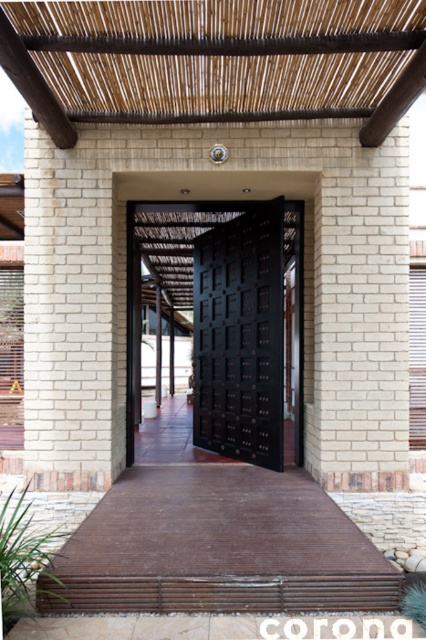
Question: Which of the following is the farthest from the observer?

Choices:
 (A) white brick pillar at left
 (B) white brick pillar at center
 (C) black matte door at center

Answer: (C)

Question: Estimate the real-world distances between objects in this image. Which object is closer to the white brick pillar at center?

Choices:
 (A) black matte door at center
 (B) white brick pillar at left

Answer: (A)

Question: Does white brick pillar at center appear on the right side of black matte door at center?

Choices:
 (A) yes
 (B) no

Answer: (A)

Question: Is white brick pillar at center wider than black matte door at center?

Choices:
 (A) yes
 (B) no

Answer: (B)

Question: Does white brick pillar at center appear on the left side of white brick pillar at left?

Choices:
 (A) no
 (B) yes

Answer: (A)

Question: Which object is closer to the camera taking this photo?

Choices:
 (A) white brick pillar at center
 (B) black matte door at center
 (C) white brick pillar at left

Answer: (A)